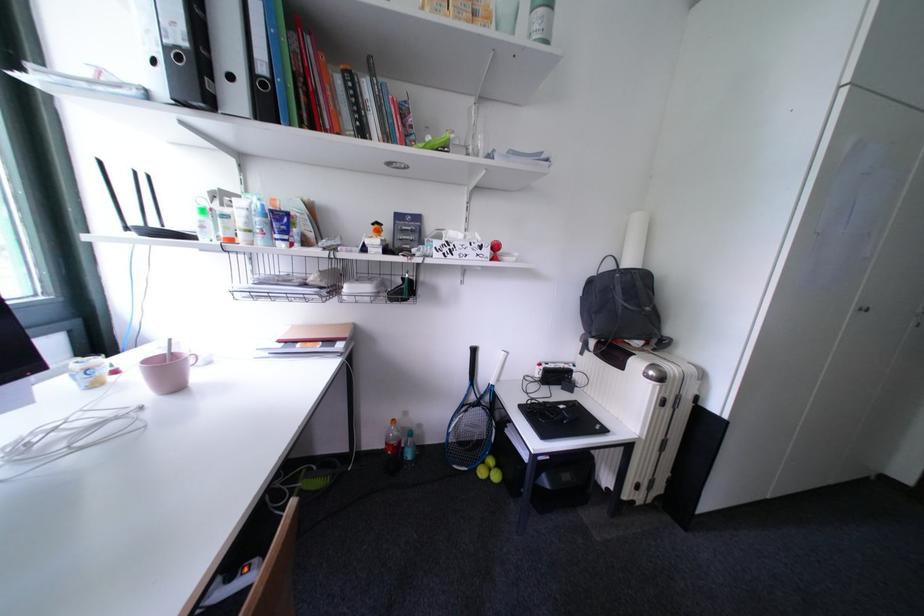
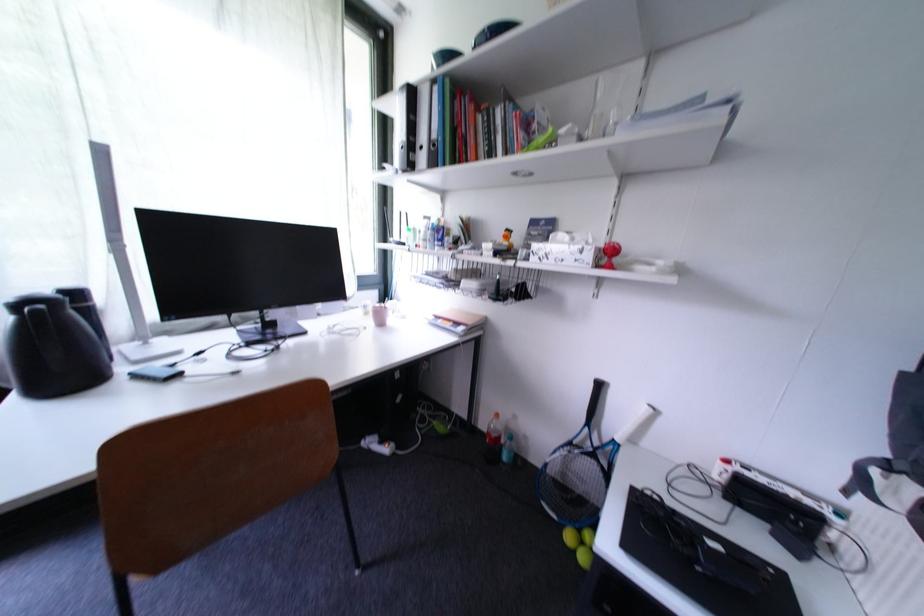
Find the pixel in the second image that matches point (499, 386) in the first image.

(625, 440)